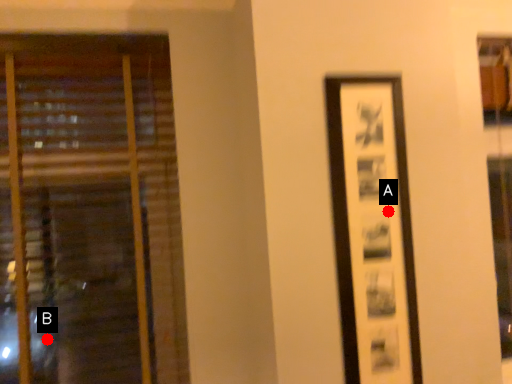
Question: Two points are circled on the image, labeled by A and B beside each circle. Which point is closer to the camera?

Choices:
 (A) A is closer
 (B) B is closer

Answer: (A)